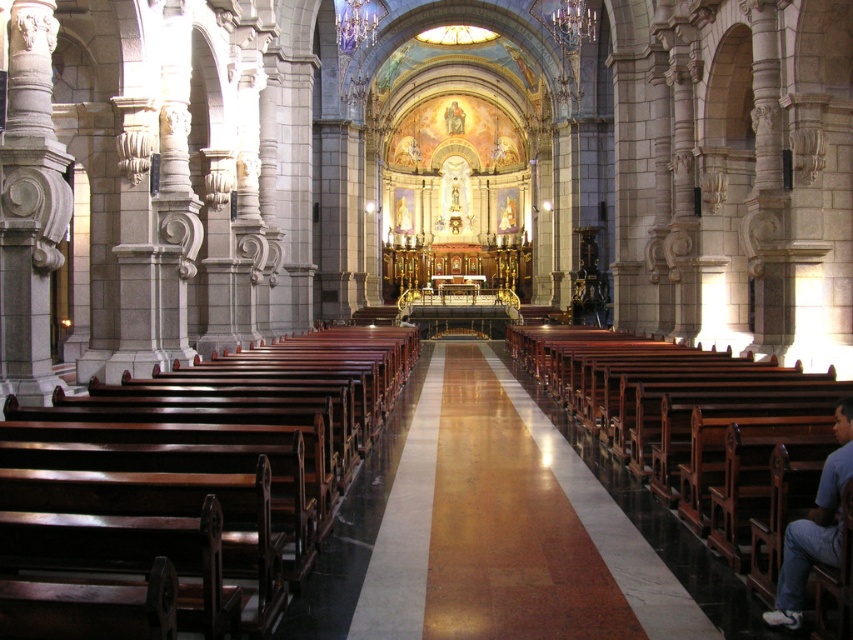
Who is shorter, polished dark wood bench at center or polished wood bench at center?

polished dark wood bench at center

Find the location of a particular element. Image resolution: width=853 pixels, height=640 pixels. polished dark wood bench at center is located at coordinates (221, 442).

Does point (120, 502) come farther from viewer compared to point (828, 525)?

No, it is not.

Does point (299, 388) come closer to viewer compared to point (787, 538)?

No.

Is point (177, 385) positioned in front of point (849, 397)?

That is False.

This screenshot has width=853, height=640. What are the coordinates of `polished dark wood bench at center` in the screenshot? It's located at (221, 442).

Is brown polished wood aisle at center positioned in front of blue cotton shirt at lower right?

That is False.

In the scene shown: Who is positioned more to the left, brown polished wood aisle at center or blue cotton shirt at lower right?

From the viewer's perspective, brown polished wood aisle at center appears more on the left side.

Is point (463, 561) closer to camera compared to point (840, 458)?

No, it is behind (840, 458).

This screenshot has height=640, width=853. Identify the location of brown polished wood aisle at center. (508, 529).